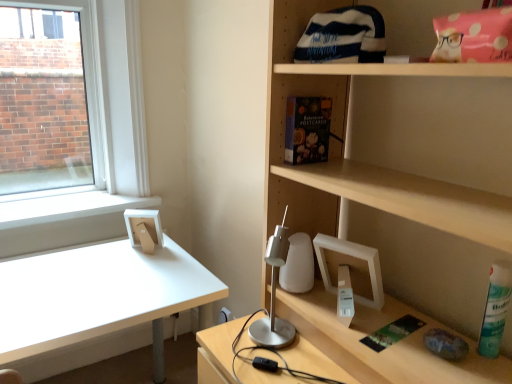
The image size is (512, 384). Describe the element at coordinates (97, 294) in the screenshot. I see `white matte desk at left` at that location.

The width and height of the screenshot is (512, 384). Find the location of `green matte spray can at lower right`. green matte spray can at lower right is located at coordinates (495, 308).

From a real-world perspective, who is located higher, matte floral-patterned book at upper center or green matte spray can at lower right?

matte floral-patterned book at upper center.

Can we say matte floral-patterned book at upper center lies outside green matte spray can at lower right?

matte floral-patterned book at upper center lies outside green matte spray can at lower right's area.

Where is `bottle on the right of matte floral-patterned book at upper center`? The width and height of the screenshot is (512, 384). bottle on the right of matte floral-patterned book at upper center is located at coordinates (495, 308).

How far apart are matte floral-patterned book at upper center and green matte spray can at lower right?

matte floral-patterned book at upper center is 21.71 inches away from green matte spray can at lower right.

Is white matte desk at left far away from matte floral-patterned book at upper center?

No, there isn't a large distance between white matte desk at left and matte floral-patterned book at upper center.

Is white matte desk at left positioned in front of matte floral-patterned book at upper center?

No, it is behind matte floral-patterned book at upper center.

Does white matte desk at left appear on the right side of matte floral-patterned book at upper center?

No.

Consider the image. Can you confirm if white matte desk at left is wider than matte floral-patterned book at upper center?

Indeed, white matte desk at left has a greater width compared to matte floral-patterned book at upper center.

Is white matte desk at left at the right side of green matte spray can at lower right?

In fact, white matte desk at left is to the left of green matte spray can at lower right.

Which of these two, white matte desk at left or green matte spray can at lower right, stands shorter?

green matte spray can at lower right.

Which of these two, white matte desk at left or green matte spray can at lower right, is bigger?

white matte desk at left is bigger.

Is green matte spray can at lower right oriented towards white matte desk at left?

No, green matte spray can at lower right is not turned towards white matte desk at left.

From the image's perspective, is green matte spray can at lower right above or below white matte desk at left?

From the image's perspective, green matte spray can at lower right appears above white matte desk at left.

How different are the orientations of green matte spray can at lower right and white matte desk at left in degrees?

There is a 91.9-degree angle between the facing directions of green matte spray can at lower right and white matte desk at left.

From a real-world perspective, which object stands above the other?

green matte spray can at lower right.

Considering the sizes of objects matte floral-patterned book at upper center and white matte desk at left in the image provided, who is bigger, matte floral-patterned book at upper center or white matte desk at left?

white matte desk at left is bigger.

Measure the distance between matte floral-patterned book at upper center and white matte desk at left.

matte floral-patterned book at upper center is 82.28 centimeters from white matte desk at left.

Is matte floral-patterned book at upper center outside of white matte desk at left?

Indeed, matte floral-patterned book at upper center is completely outside white matte desk at left.

Is matte floral-patterned book at upper center facing away from white matte desk at left?

No, matte floral-patterned book at upper center is not facing the opposite direction of white matte desk at left.

Identify the location of book on the left of green matte spray can at lower right. The height and width of the screenshot is (384, 512). (307, 129).

Can you confirm if green matte spray can at lower right is taller than matte floral-patterned book at upper center?

Indeed, green matte spray can at lower right has a greater height compared to matte floral-patterned book at upper center.

What's the angular difference between green matte spray can at lower right and matte floral-patterned book at upper center's facing directions?

1.9 degrees separate the facing orientations of green matte spray can at lower right and matte floral-patterned book at upper center.

From the image's perspective, between green matte spray can at lower right and matte floral-patterned book at upper center, which one is located above?

matte floral-patterned book at upper center is shown above in the image.

You are a GUI agent. You are given a task and a screenshot of the screen. Output one action in this format:
    pyautogui.click(x=<x>, y=<y>)
    Task: Click on the bottle located underneath the matte floral-patterned book at upper center (from a real-world perspective)
    This screenshot has width=512, height=384.
    Given the screenshot: What is the action you would take?
    pyautogui.click(x=495, y=308)

I want to click on book above the white matte desk at left (from the image's perspective), so click(x=307, y=129).

Which object lies nearer to the anchor point white matte desk at left, green matte spray can at lower right or matte floral-patterned book at upper center?

matte floral-patterned book at upper center lies closer to white matte desk at left than the other object.

Based on their spatial positions, is white matte desk at left or green matte spray can at lower right closer to matte floral-patterned book at upper center?

green matte spray can at lower right is closer to matte floral-patterned book at upper center.

Considering their positions, is white matte desk at left positioned closer to green matte spray can at lower right than matte floral-patterned book at upper center?

Based on the image, matte floral-patterned book at upper center appears to be nearer to green matte spray can at lower right.

Estimate the real-world distances between objects in this image. Which object is closer to white matte desk at left, matte floral-patterned book at upper center or green matte spray can at lower right?

matte floral-patterned book at upper center is closer to white matte desk at left.

Considering their positions, is green matte spray can at lower right positioned closer to matte floral-patterned book at upper center than white matte desk at left?

green matte spray can at lower right.

Looking at the image, which one is located further to green matte spray can at lower right, matte floral-patterned book at upper center or white matte desk at left?

The object further to green matte spray can at lower right is white matte desk at left.

The height and width of the screenshot is (384, 512). I want to click on book between white matte desk at left and green matte spray can at lower right from left to right, so click(307, 129).